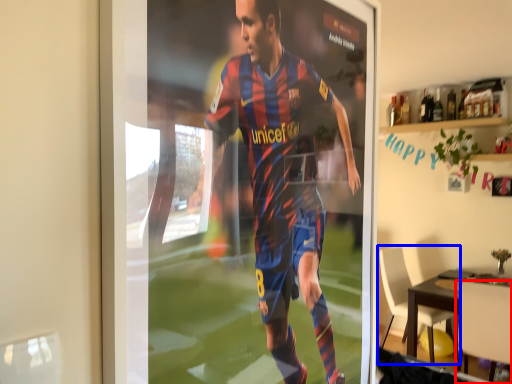
Question: Which of the following is the farthest to the observer, chair (highlighted by a red box) or chair (highlighted by a blue box)?

Choices:
 (A) chair
 (B) chair

Answer: (B)